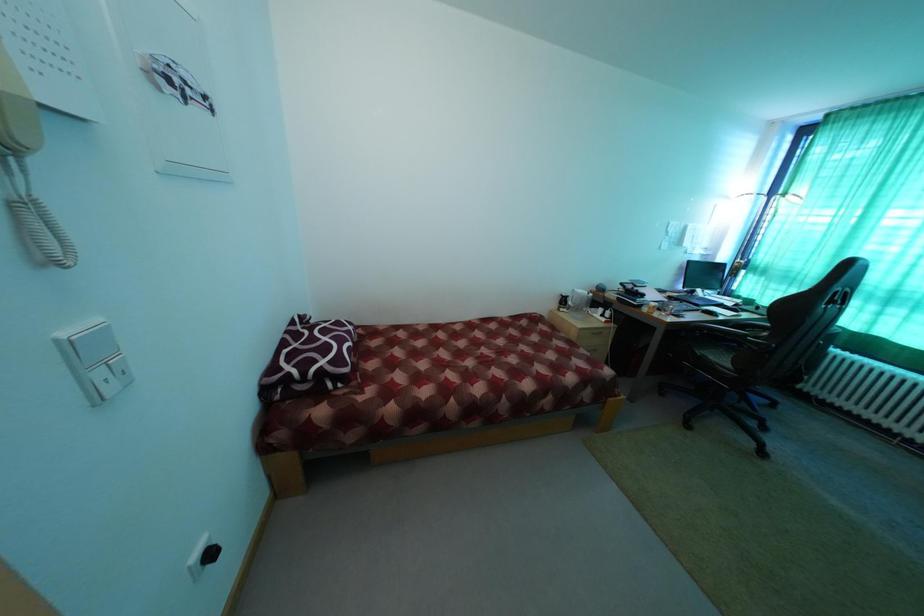
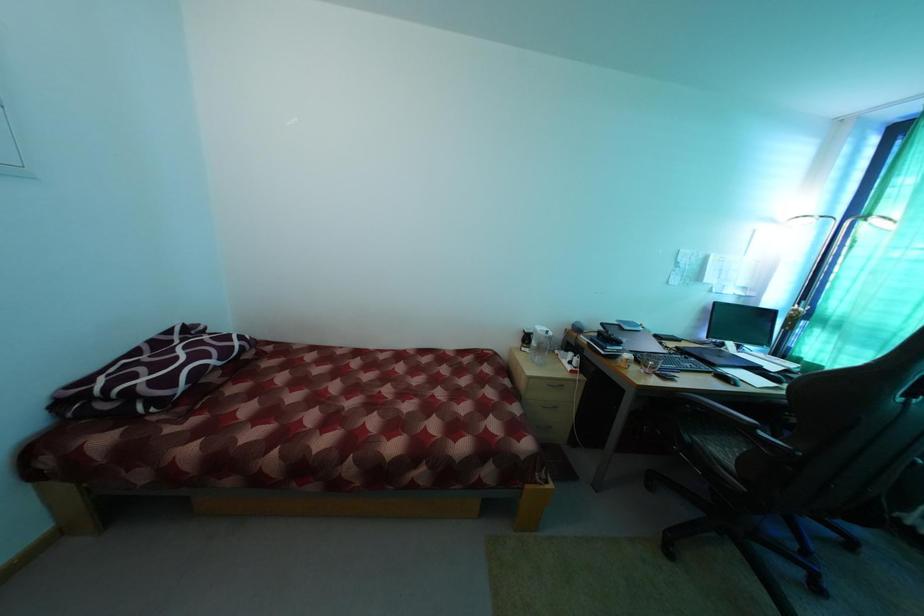
What movement of the cameraman would produce the second image?

The cameraman walked toward right, forward.